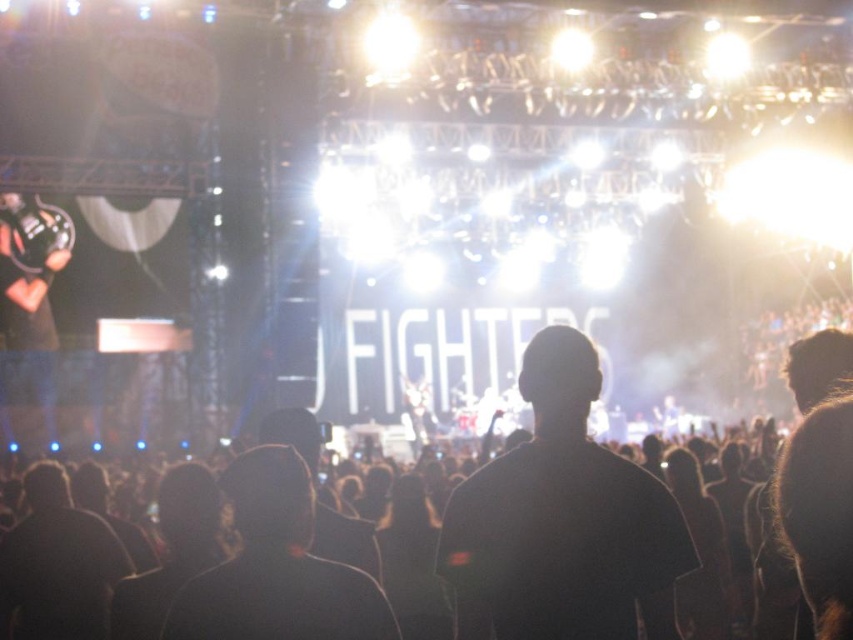
Does point (502, 506) come in front of point (180, 618)?

No, (502, 506) is further to viewer.

What do you see at coordinates (561, 522) in the screenshot? The width and height of the screenshot is (853, 640). I see `black matte headband at center` at bounding box center [561, 522].

The width and height of the screenshot is (853, 640). What are the coordinates of `black matte headband at center` in the screenshot? It's located at (561, 522).

Can you confirm if black matte shirt at center is thinner than black matte headband at center?

No, black matte shirt at center is not thinner than black matte headband at center.

Between black matte shirt at center and black matte headband at center, which one is positioned higher?

black matte headband at center

You are a GUI agent. You are given a task and a screenshot of the screen. Output one action in this format:
    pyautogui.click(x=<x>, y=<y>)
    Task: Click on the black matte shirt at center
    
    Given the screenshot: What is the action you would take?
    pyautogui.click(x=392, y=544)

How far apart are black matte shirt at center and black matte jacket at center?

A distance of 9.72 meters exists between black matte shirt at center and black matte jacket at center.

Does black matte shirt at center have a larger size compared to black matte jacket at center?

Correct, black matte shirt at center is larger in size than black matte jacket at center.

Where is `black matte shirt at center`? The height and width of the screenshot is (640, 853). black matte shirt at center is located at coordinates (392, 544).

Where is `black matte shirt at center`? Image resolution: width=853 pixels, height=640 pixels. black matte shirt at center is located at coordinates (392, 544).